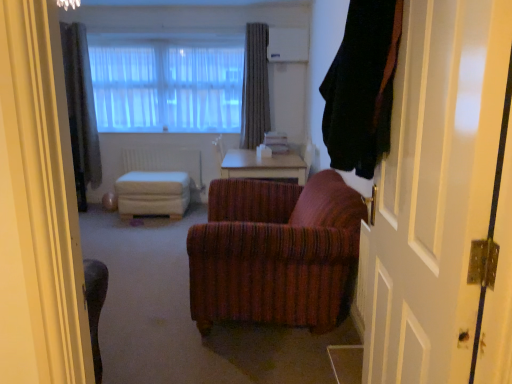
Image resolution: width=512 pixels, height=384 pixels. What are the coordinates of `vacant region above translucent fabric at upper center (from a real-world perspective)` in the screenshot? It's located at (163, 34).